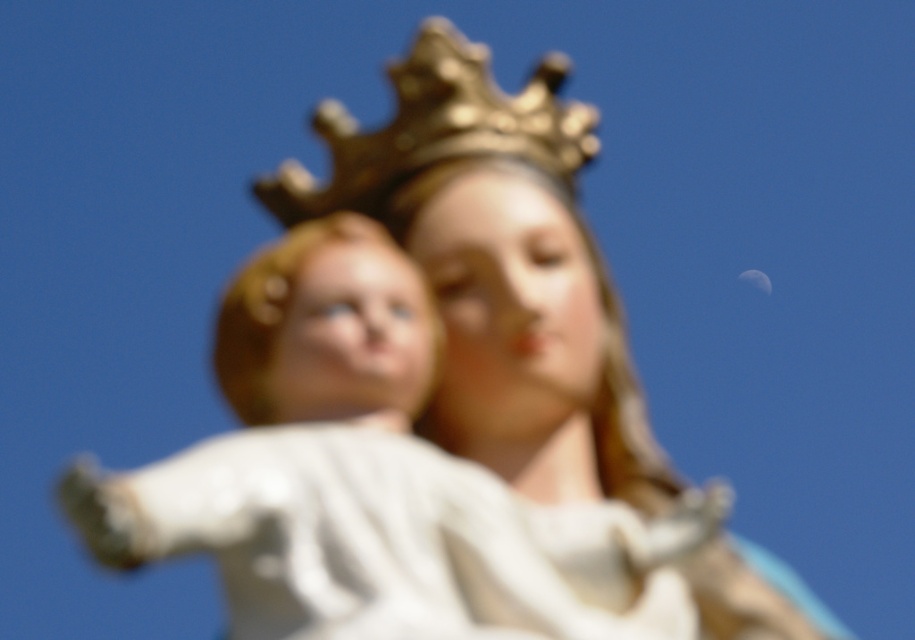
Question: Is white porcelain child at center wider than gold metallic crown at upper center?

Choices:
 (A) no
 (B) yes

Answer: (B)

Question: Among these objects, which one is nearest to the camera?

Choices:
 (A) white porcelain child at center
 (B) gold metallic crown at upper center

Answer: (A)

Question: Which point is farther to the camera?

Choices:
 (A) (423, 317)
 (B) (423, 122)

Answer: (B)

Question: Can you confirm if white porcelain child at center is positioned below gold metallic crown at upper center?

Choices:
 (A) no
 (B) yes

Answer: (B)

Question: Can you confirm if white porcelain child at center is positioned below gold metallic crown at upper center?

Choices:
 (A) yes
 (B) no

Answer: (A)

Question: Which of the following is the farthest from the observer?

Choices:
 (A) white porcelain child at center
 (B) gold metallic crown at upper center

Answer: (B)